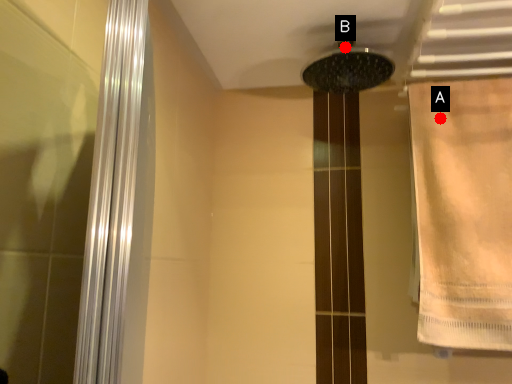
Question: Two points are circled on the image, labeled by A and B beside each circle. Which point is farther from the camera taking this photo?

Choices:
 (A) A is further
 (B) B is further

Answer: (A)